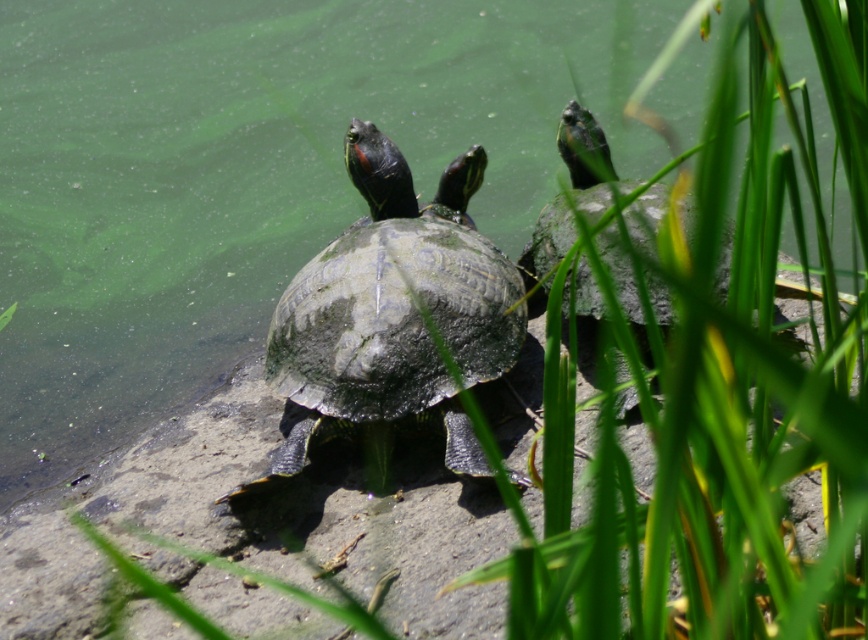
You are a photographer trying to capture a clear shot of both the green scaly tortoise at center and the green scaly tortoise at upper right. Since the foreground has tall green grasses, which tortoise might be easier to see in your photo?

The green scaly tortoise at center is easier to see because it is closer to the viewer compared to the green scaly tortoise at upper right, which is farther away and possibly more obscured by the tall green grasses in the foreground.

In the scene shown: You are standing in the scene and want to move from the point at coordinates point (446, 189) to the point at coordinates point (577, 147). Which direction should you face to walk towards the second point?

To move from point (446, 189) to point (577, 147), you should face towards the upper left direction since point (577, 147) is located above and to the left of point (446, 189).